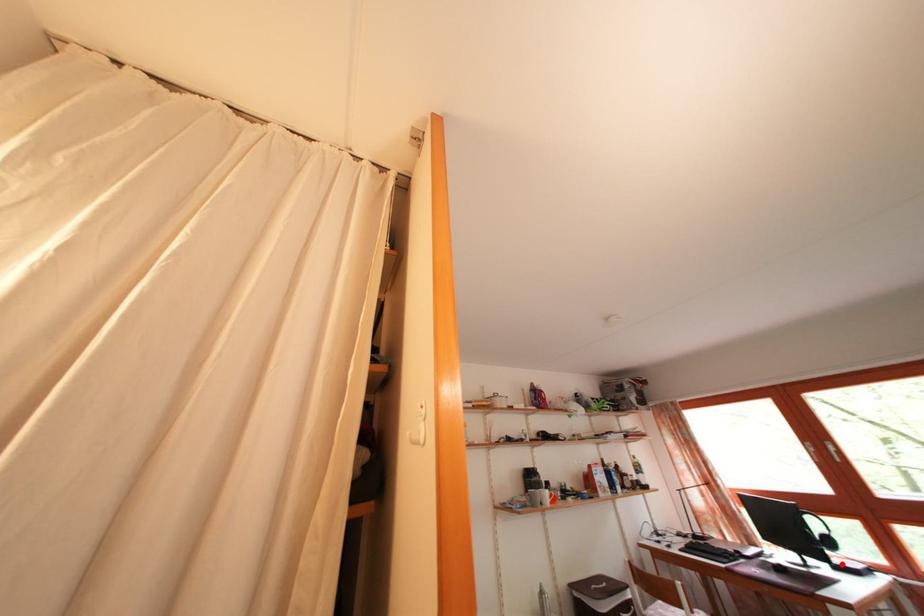
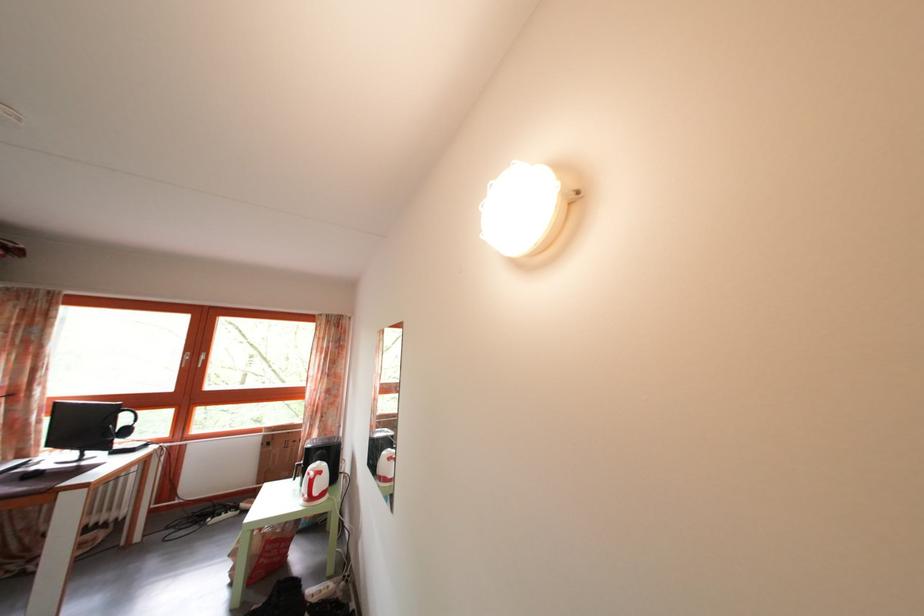
Find the pixel in the second image that matches the highlighted location in the first image.

(128, 451)